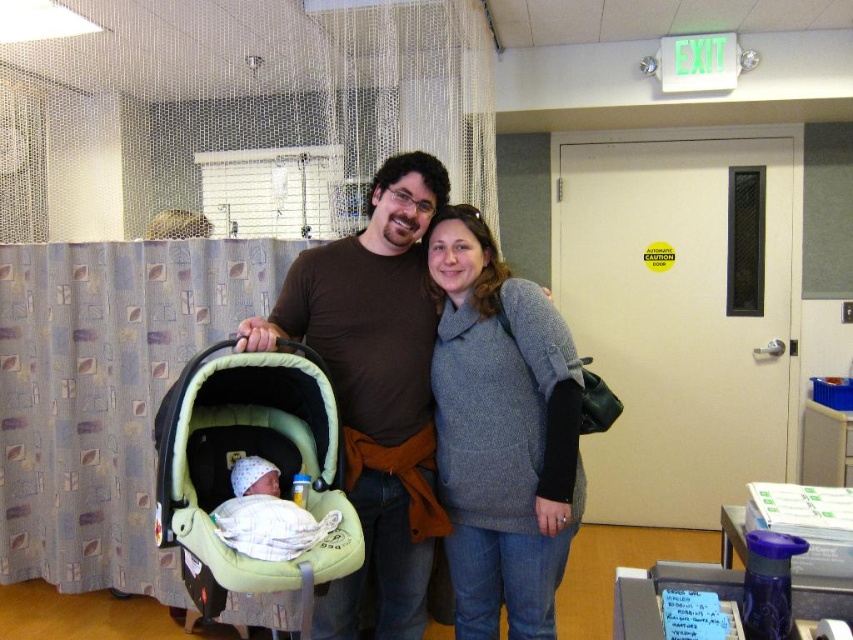
Based on the photo, you are a nurse in the hospital room and need to determine the distance between two points marked on the floor for safety equipment placement. The points are labeled as point (408, 611) and point (259, 506). Given that the room is 10 meters deep from the camera to the far wall, can you estimate which point is closer to the camera?

Point (408, 611) is further to the camera than point (259, 506). Therefore, point (259, 506) is closer to the camera.